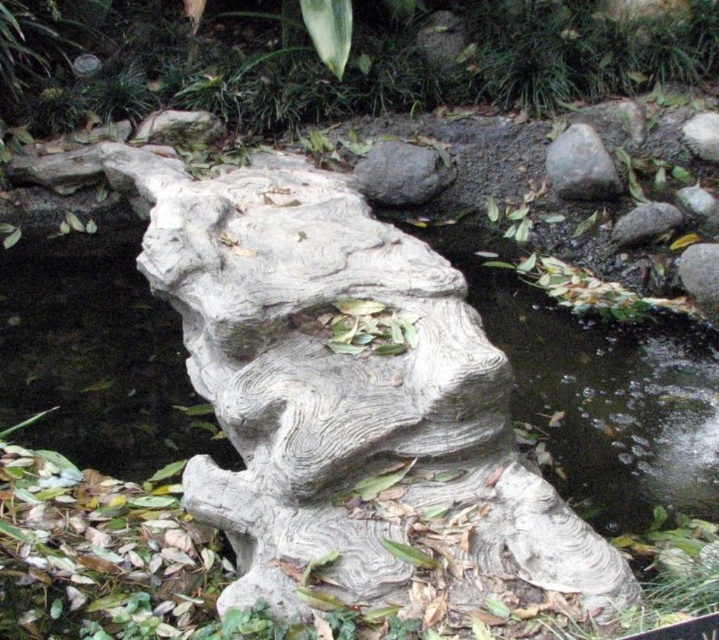
You are standing on the edge of the pond and see the gray rough rock at upper center and the gray wood log at center. Which object is higher in elevation compared to the other?

The gray rough rock at upper center is located above the gray wood log at center, so it is higher in elevation.

You are a painter standing at the edge of the water. You want to paint the gray wood log at center and the white textured rock at upper right. Can you paint both without moving your easel if your easel has a 35 inch wide canvas?

The gray wood log at center and the white textured rock at upper right are 35.41 inches apart. Since the distance between them is slightly more than 35 inches, the painter would need to move the easel to capture both on the canvas.